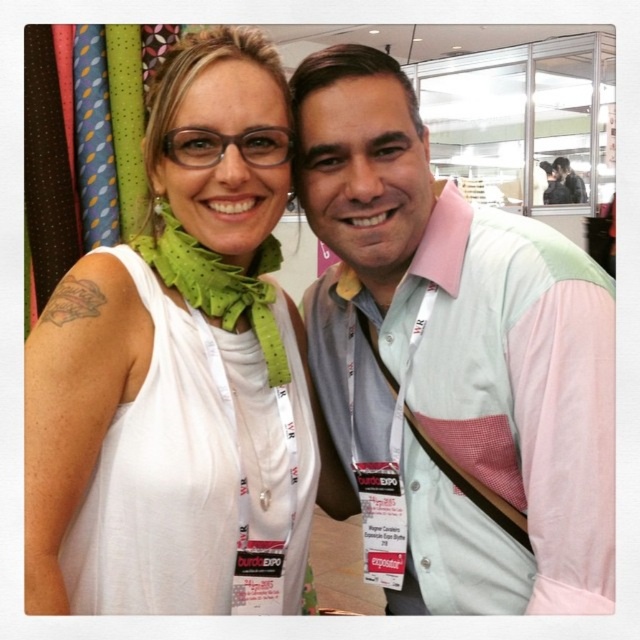
You are a photographer at the exhibition and want to ensure both the pink fabric vest at center and the white fabric at center are fully visible in the photo. Which one should you adjust the camera angle to focus on first?

The pink fabric vest at center is much taller than the white fabric at center, so you should adjust the camera angle to focus on the pink fabric vest at center first to ensure it is fully visible.

You are a tailor who needs to decide which fabric item to place in a 1.2 meter wide display case. Based on the image, which item between the pink fabric vest at center and the green polka dot fabric scarf at upper left would fit better in terms of width?

The pink fabric vest at center has a greater width than the green polka dot fabric scarf at upper left. Therefore, the pink fabric vest at center would require more space and might not fit in the 1.2 meter wide display case, whereas the green polka dot fabric scarf at upper left could fit better due to its narrower width.